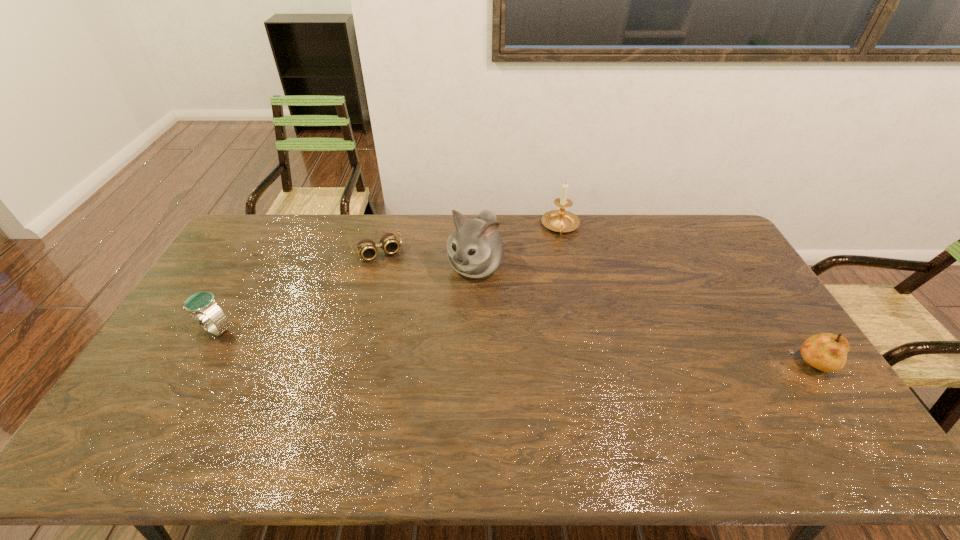
Locate an element on the screen. vacant space that's between the pear and the leftmost object is located at coordinates (512, 347).

Locate which object is the third closest to the leftmost object. Please provide its 2D coordinates. Your answer should be formatted as a tuple, i.e. [(x, y)], where the tuple contains the x and y coordinates of a point satisfying the conditions above.

[(561, 220)]

Locate which object ranks in proximity to the leftmost object. Please provide its 2D coordinates. Your answer should be formatted as a tuple, i.e. [(x, y)], where the tuple contains the x and y coordinates of a point satisfying the conditions above.

[(367, 249)]

Where is `vacant space that satisfies the following two spatial constraints: 1. on the back side of the hamster; 2. on the right side of the fourth shortest object`? vacant space that satisfies the following two spatial constraints: 1. on the back side of the hamster; 2. on the right side of the fourth shortest object is located at coordinates (476, 227).

This screenshot has height=540, width=960. I want to click on free space that satisfies the following two spatial constraints: 1. on the back side of the leftmost object; 2. on the right side of the candle holder, so click(x=275, y=227).

Identify the location of free location that satisfies the following two spatial constraints: 1. on the front side of the second nearest object; 2. on the right side of the pear. This screenshot has height=540, width=960. (196, 364).

At what (x,y) coordinates should I click in order to perform the action: click on vacant point that satisfies the following two spatial constraints: 1. on the back side of the candle holder; 2. on the right side of the fourth object from right to left. Please return your answer as a coordinate pair (x, y). Looking at the image, I should click on (384, 227).